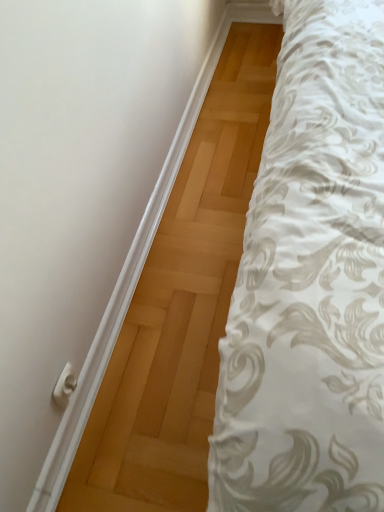
Question: Considering the relative sizes of white plastic door handle at lower left and white matte door at upper left in the image provided, is white plastic door handle at lower left bigger than white matte door at upper left?

Choices:
 (A) yes
 (B) no

Answer: (B)

Question: Is white plastic door handle at lower left oriented towards white matte door at upper left?

Choices:
 (A) yes
 (B) no

Answer: (B)

Question: Can you confirm if white plastic door handle at lower left is wider than white matte door at upper left?

Choices:
 (A) no
 (B) yes

Answer: (A)

Question: From a real-world perspective, is white plastic door handle at lower left physically below white matte door at upper left?

Choices:
 (A) yes
 (B) no

Answer: (B)

Question: Is white plastic door handle at lower left in front of white matte door at upper left?

Choices:
 (A) yes
 (B) no

Answer: (B)

Question: From a real-world perspective, is white plastic door handle at lower left located higher than white matte door at upper left?

Choices:
 (A) no
 (B) yes

Answer: (B)

Question: From a real-world perspective, does white matte door at upper left stand above white plastic door handle at lower left?

Choices:
 (A) yes
 (B) no

Answer: (B)

Question: Is white matte door at upper left not close to white plastic door handle at lower left?

Choices:
 (A) yes
 (B) no

Answer: (B)

Question: Is white plastic door handle at lower left inside white matte door at upper left?

Choices:
 (A) yes
 (B) no

Answer: (B)

Question: Is white matte door at upper left facing away from white plastic door handle at lower left?

Choices:
 (A) yes
 (B) no

Answer: (B)

Question: From a real-world perspective, is white matte door at upper left below white plastic door handle at lower left?

Choices:
 (A) no
 (B) yes

Answer: (B)

Question: Are white matte door at upper left and white plastic door handle at lower left beside each other?

Choices:
 (A) yes
 (B) no

Answer: (B)

Question: Looking at the image, does white plastic door handle at lower left seem bigger or smaller compared to white matte door at upper left?

Choices:
 (A) big
 (B) small

Answer: (B)